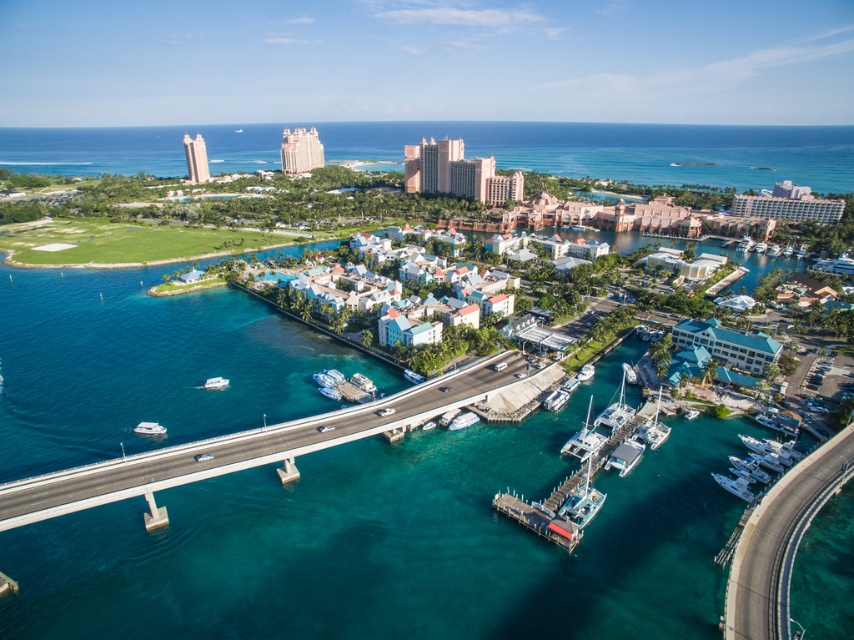
You are a drone operator tasked with capturing aerial footage of the resort. You have to fly your drone from the white matte boat at center to the clear blue water at center. Considering the height difference between them, will your drone need to ascend or descend to reach the destination?

The clear blue water at center has a greater height compared to the white matte boat at center. Therefore, the drone will need to ascend to reach the destination.

Looking at this image, you are standing at the point with coordinates point (483, 365) and want to move towards the bridge in the scene. Is the point point (559, 480) located between you and the bridge or behind the bridge?

Point 0.750, 0.656 is closer to the viewer than point (483, 365). Since you are at point (483, 365), the point (559, 480) is behind you and thus behind the bridge.

Based on the photo, you are a tour guide explaining the boats in the image to visitors. You mention both the white matte boat at center and the white glossy boat at lower left. Which boat is wider?

The white matte boat at center is wider than the white glossy boat at lower left.